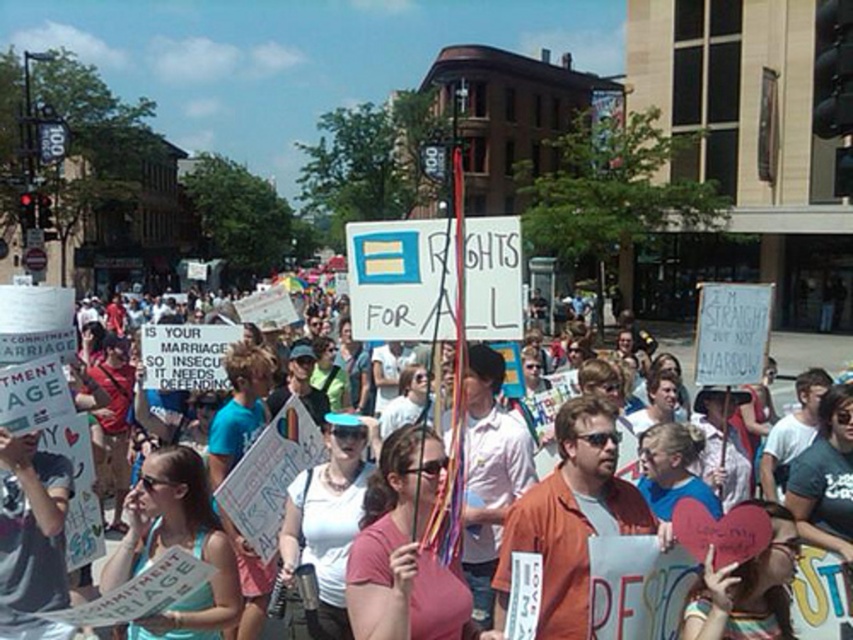
From the picture: Is the position of pink matte t-shirt at center less distant than that of light blue tank top at center?

Yes, pink matte t-shirt at center is closer to the viewer.

Who is positioned more to the right, pink matte t-shirt at center or light blue tank top at center?

pink matte t-shirt at center is more to the right.

Identify the location of pink matte t-shirt at center. (405, 550).

At what (x,y) coordinates should I click in order to perform the action: click on pink matte t-shirt at center. Please return your answer as a coordinate pair (x, y). The image size is (853, 640). Looking at the image, I should click on (405, 550).

Is pink matte t-shirt at center above white paper sign at center?

Incorrect, pink matte t-shirt at center is not positioned above white paper sign at center.

The height and width of the screenshot is (640, 853). What do you see at coordinates (405, 550) in the screenshot?
I see `pink matte t-shirt at center` at bounding box center [405, 550].

Find the location of a particular element. The height and width of the screenshot is (640, 853). pink matte t-shirt at center is located at coordinates (405, 550).

Is orange cotton shirt at center bigger than pink matte t-shirt at center?

Yes, orange cotton shirt at center is bigger than pink matte t-shirt at center.

In the scene shown: Which is more to the left, orange cotton shirt at center or pink matte t-shirt at center?

pink matte t-shirt at center is more to the left.

Who is more distant from viewer, [573,428] or [375,500]?

Point [375,500]

You are a GUI agent. You are given a task and a screenshot of the screen. Output one action in this format:
    pyautogui.click(x=<x>, y=<y>)
    Task: Click on the orange cotton shirt at center
    The width and height of the screenshot is (853, 640).
    Given the screenshot: What is the action you would take?
    pyautogui.click(x=572, y=516)